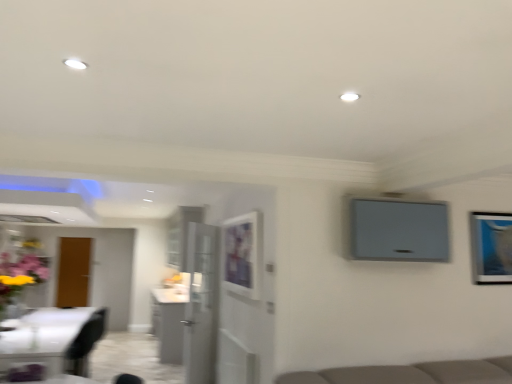
The image size is (512, 384). What do you see at coordinates (242, 255) in the screenshot?
I see `matte white picture frame at center, the second picture frame from the right` at bounding box center [242, 255].

Image resolution: width=512 pixels, height=384 pixels. Describe the element at coordinates (490, 247) in the screenshot. I see `metallic silver picture frame at upper right, which ranks as the 2th picture frame in left-to-right order` at that location.

Describe the element at coordinates (21, 271) in the screenshot. I see `matte purple vase at left` at that location.

Identify the location of matte white picture frame at center, acting as the first picture frame starting from the left. This screenshot has width=512, height=384. (242, 255).

From the image's perspective, relative to matte white picture frame at center, acting as the first picture frame starting from the left, is matte purple vase at left above or below?

Clearly, from the image's perspective, matte purple vase at left is below matte white picture frame at center, acting as the first picture frame starting from the left.

Is matte white picture frame at center, acting as the first picture frame starting from the left, surrounded by matte purple vase at left?

No, matte white picture frame at center, acting as the first picture frame starting from the left, is not inside matte purple vase at left.

Which is behind, point (3, 295) or point (227, 227)?

Positioned behind is point (3, 295).

Between matte purple vase at left and matte white picture frame at center, acting as the first picture frame starting from the left, which one is positioned behind?

matte purple vase at left is more distant.

Looking at this image, from the image's perspective, is metallic silver picture frame at upper right, which is the 1th picture frame in right-to-left order, on top of matte purple vase at left?

Yes, from the image's perspective, metallic silver picture frame at upper right, which is the 1th picture frame in right-to-left order, is on top of matte purple vase at left.

What's the angular difference between metallic silver picture frame at upper right, which ranks as the 2th picture frame in left-to-right order, and matte purple vase at left's facing directions?

90.4 degrees.

Is metallic silver picture frame at upper right, which is the 1th picture frame in right-to-left order, positioned far away from matte purple vase at left?

Absolutely, metallic silver picture frame at upper right, which is the 1th picture frame in right-to-left order, is distant from matte purple vase at left.

Find the location of a particular element. This screenshot has width=512, height=384. floral arrangement that is on the left side of metallic silver picture frame at upper right, which is the 1th picture frame in right-to-left order is located at coordinates (21, 271).

Between point (4, 304) and point (177, 348), which one is positioned behind?

Positioned behind is point (177, 348).

Is matte purple vase at left positioned with its back to white glossy cabinet at center?

No, matte purple vase at left is not facing the opposite direction of white glossy cabinet at center.

Would you say white glossy cabinet at center is part of matte purple vase at left's contents?

No, matte purple vase at left does not contain white glossy cabinet at center.

Which object is closer to the camera taking this photo, matte purple vase at left or white glossy cabinet at center?

Positioned in front is matte purple vase at left.

Is white glossy cabinet at center located outside matte white picture frame at center, the second picture frame from the right?

Yes, white glossy cabinet at center is not within matte white picture frame at center, the second picture frame from the right.

Between white glossy cabinet at center and matte white picture frame at center, acting as the first picture frame starting from the left, which one appears on the right side from the viewer's perspective?

matte white picture frame at center, acting as the first picture frame starting from the left, is more to the right.

Between white glossy cabinet at center and matte white picture frame at center, the second picture frame from the right, which one has larger width?

white glossy cabinet at center is wider.

Locate an element on the screen. cabinetry behind the matte white picture frame at center, the second picture frame from the right is located at coordinates (168, 323).

Considering the sizes of transparent glass door at center and white glossy cabinet at center in the image, is transparent glass door at center taller or shorter than white glossy cabinet at center?

Clearly, transparent glass door at center is taller compared to white glossy cabinet at center.

Considering the positions of point (210, 244) and point (170, 337), is point (210, 244) closer or farther from the camera than point (170, 337)?

Point (210, 244) appears to be closer to the viewer than point (170, 337).

Looking at this image, from a real-world perspective, which object rests below the other?

From a 3D spatial view, white glossy cabinet at center is below.

Is transparent glass door at center surrounding white glossy cabinet at center?

No, white glossy cabinet at center is not inside transparent glass door at center.

Where is `cabinetry on the left of the transparent glass door at center`? This screenshot has height=384, width=512. cabinetry on the left of the transparent glass door at center is located at coordinates (168, 323).

Is white glossy cabinet at center to the left of transparent glass door at center from the viewer's perspective?

Correct, you'll find white glossy cabinet at center to the left of transparent glass door at center.

From the image's perspective, is white glossy cabinet at center above or below transparent glass door at center?

Clearly, from the image's perspective, white glossy cabinet at center is below transparent glass door at center.

Do you think white glossy cabinet at center is within transparent glass door at center, or outside of it?

white glossy cabinet at center is not enclosed by transparent glass door at center.

Considering the sizes of transparent glass door at center and matte white picture frame at center, the second picture frame from the right, in the image, is transparent glass door at center taller or shorter than matte white picture frame at center, the second picture frame from the right,?

Clearly, transparent glass door at center is taller compared to matte white picture frame at center, the second picture frame from the right.

Considering the relative positions of transparent glass door at center and matte white picture frame at center, acting as the first picture frame starting from the left, in the image provided, is transparent glass door at center to the left or to the right of matte white picture frame at center, acting as the first picture frame starting from the left,?

Based on their positions, transparent glass door at center is located to the left of matte white picture frame at center, acting as the first picture frame starting from the left.

Considering the points (208, 255) and (244, 225), which point is behind, point (208, 255) or point (244, 225)?

Positioned behind is point (208, 255).

Is transparent glass door at center positioned with its back to matte white picture frame at center, acting as the first picture frame starting from the left?

transparent glass door at center is not turned away from matte white picture frame at center, acting as the first picture frame starting from the left.

This screenshot has height=384, width=512. Identify the location of floral arrangement below the matte white picture frame at center, the second picture frame from the right (from the image's perspective). (21, 271).

Locate an element on the screen. The height and width of the screenshot is (384, 512). the 2nd picture frame counting from the right side of the matte purple vase at left is located at coordinates (490, 247).

Consider the image. Looking at the image, which one is located further to metallic silver picture frame at upper right, which is the 1th picture frame in right-to-left order, matte purple vase at left or matte white picture frame at center, the second picture frame from the right?

Based on the image, matte purple vase at left appears to be further to metallic silver picture frame at upper right, which is the 1th picture frame in right-to-left order.

Looking at the image, which one is located closer to matte purple vase at left, metallic silver picture frame at upper right, which ranks as the 2th picture frame in left-to-right order, or transparent glass door at center?

The object closer to matte purple vase at left is transparent glass door at center.

Based on their spatial positions, is matte white picture frame at center, the second picture frame from the right, or matte purple vase at left closer to transparent glass door at center?

Based on the image, matte white picture frame at center, the second picture frame from the right, appears to be nearer to transparent glass door at center.

Estimate the real-world distances between objects in this image. Which object is further from matte white picture frame at center, acting as the first picture frame starting from the left, transparent glass door at center or white glossy cabinet at center?

The object further to matte white picture frame at center, acting as the first picture frame starting from the left, is white glossy cabinet at center.

From the image, which object appears to be nearer to metallic silver picture frame at upper right, which is the 1th picture frame in right-to-left order, matte white picture frame at center, acting as the first picture frame starting from the left, or transparent glass door at center?

matte white picture frame at center, acting as the first picture frame starting from the left, lies closer to metallic silver picture frame at upper right, which is the 1th picture frame in right-to-left order, than the other object.

When comparing their distances from transparent glass door at center, does metallic silver picture frame at upper right, which ranks as the 2th picture frame in left-to-right order, or matte purple vase at left seem closer?

Among the two, matte purple vase at left is located nearer to transparent glass door at center.

Based on their spatial positions, is transparent glass door at center or metallic silver picture frame at upper right, which is the 1th picture frame in right-to-left order, further from matte purple vase at left?

Based on the image, metallic silver picture frame at upper right, which is the 1th picture frame in right-to-left order, appears to be further to matte purple vase at left.

When comparing their distances from white glossy cabinet at center, does matte purple vase at left or transparent glass door at center seem further?

matte purple vase at left.

This screenshot has width=512, height=384. I want to click on door between matte purple vase at left and white glossy cabinet at center along the z-axis, so click(x=201, y=304).

I want to click on floral arrangement between matte white picture frame at center, the second picture frame from the right, and white glossy cabinet at center, along the z-axis, so click(x=21, y=271).

Where is `door between matte white picture frame at center, acting as the first picture frame starting from the left, and white glossy cabinet at center in the front-back direction`? This screenshot has width=512, height=384. door between matte white picture frame at center, acting as the first picture frame starting from the left, and white glossy cabinet at center in the front-back direction is located at coordinates (201, 304).

Identify the location of picture frame between matte purple vase at left and metallic silver picture frame at upper right, which is the 1th picture frame in right-to-left order, in the horizontal direction. pos(242,255).